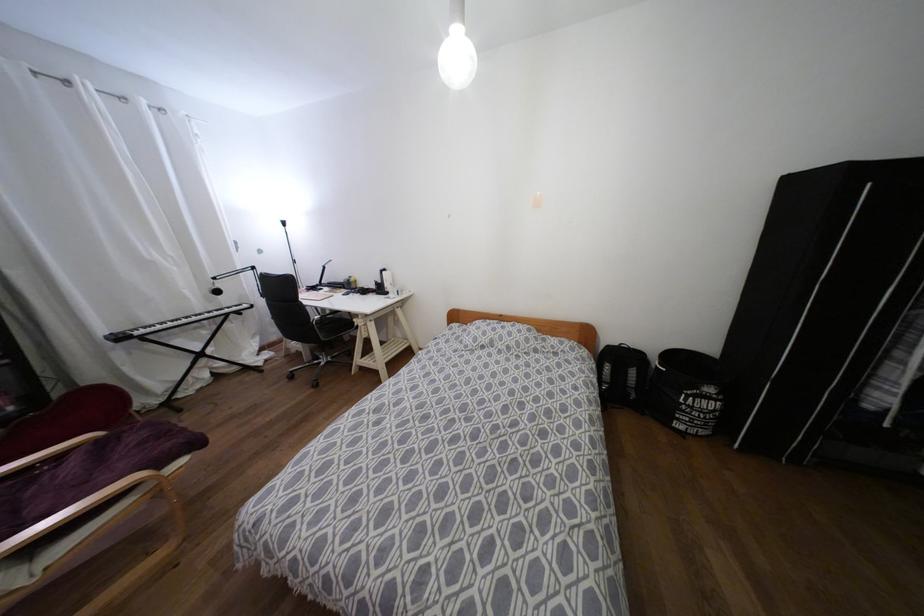
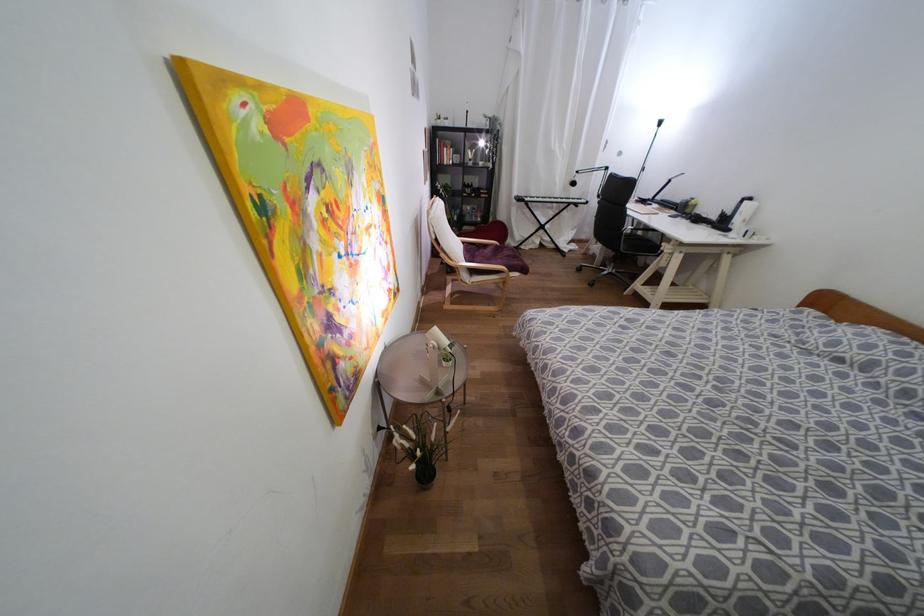
Where in the second image is the point corresponding to point 216,292 from the first image?

(573, 183)